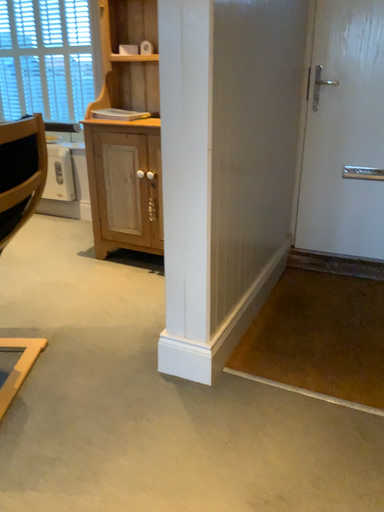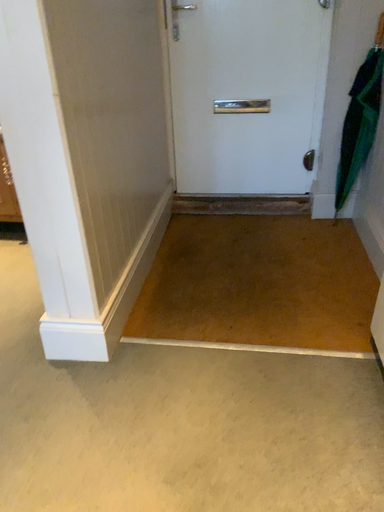
Question: Which way did the camera rotate in the video?

Choices:
 (A) rotated downward
 (B) rotated upward

Answer: (A)